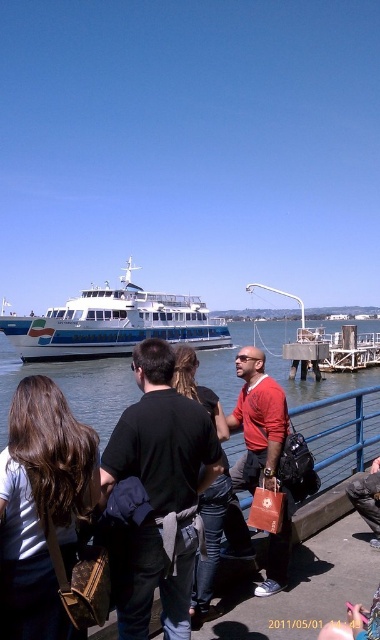
Is matte brown purse at left closer to the viewer compared to clear blue water at center?

Yes, matte brown purse at left is in front of clear blue water at center.

Is point (83, 509) closer to camera compared to point (239, 435)?

Yes, point (83, 509) is closer to viewer.

Locate an element on the screen. This screenshot has width=380, height=640. matte brown purse at left is located at coordinates (42, 508).

Is black matte shirt at center to the right of black leather jacket at center from the viewer's perspective?

In fact, black matte shirt at center is to the left of black leather jacket at center.

Consider the image. Can you confirm if black matte shirt at center is positioned below black leather jacket at center?

Correct, black matte shirt at center is located below black leather jacket at center.

Where is `black matte shirt at center`? This screenshot has width=380, height=640. black matte shirt at center is located at coordinates (161, 492).

Does point (142, 625) come in front of point (80, 506)?

No.

Who is more forward, (x=188, y=554) or (x=44, y=484)?

Point (x=44, y=484)

Where is `black matte shirt at center`? Image resolution: width=380 pixels, height=640 pixels. black matte shirt at center is located at coordinates (161, 492).